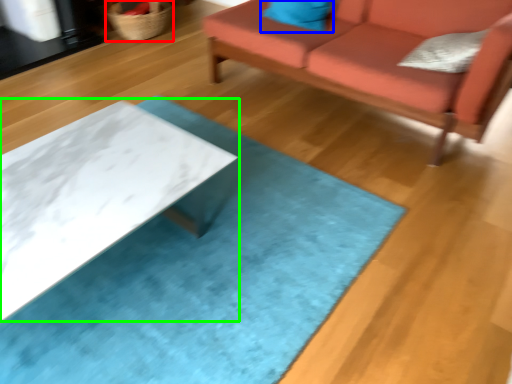
Question: Which is farther away from basket (highlighted by a red box)? pillow (highlighted by a blue box) or table (highlighted by a green box)?

Choices:
 (A) pillow
 (B) table

Answer: (B)